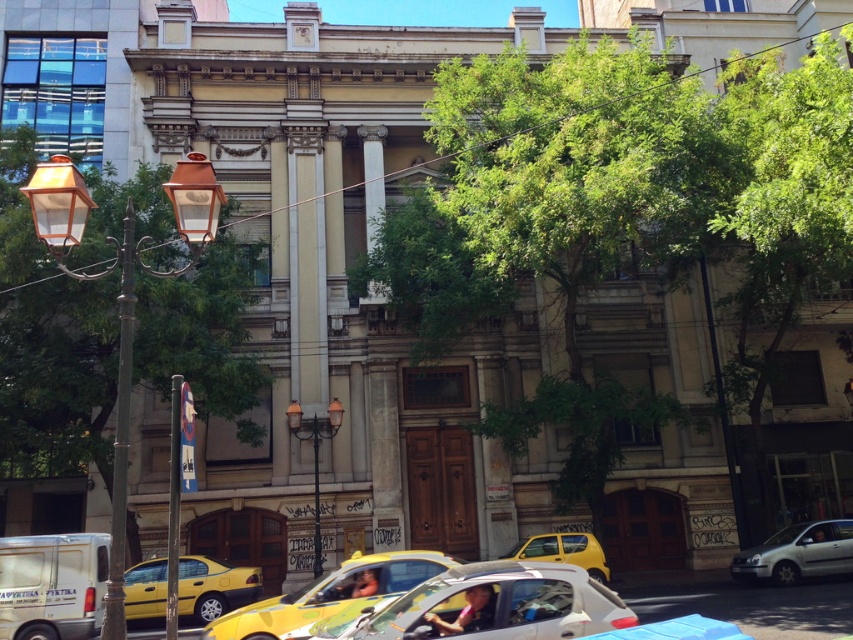
Is point (444, 573) farther from viewer compared to point (165, 611)?

No, it is in front of (165, 611).

Where is `metallic silver car at center`? This screenshot has height=640, width=853. metallic silver car at center is located at coordinates (486, 605).

At what (x,y) coordinates should I click in order to perform the action: click on metallic silver car at center. Please return your answer as a coordinate pair (x, y). The image size is (853, 640). Looking at the image, I should click on (486, 605).

Is yellow matte taxi at lower center smaller than white matte car at lower right?

Yes.

Does point (236, 572) come in front of point (845, 564)?

Yes.

The image size is (853, 640). In order to click on yellow matte taxi at lower center in this screenshot , I will do 213,586.

Measure the distance between point (73,602) and camera.

Point (73,602) and camera are 49.07 feet apart from each other.

At what (x,y) coordinates should I click in order to perform the action: click on white matte van at lower left. Please return your answer as a coordinate pair (x, y). Image resolution: width=853 pixels, height=640 pixels. Looking at the image, I should click on (51, 586).